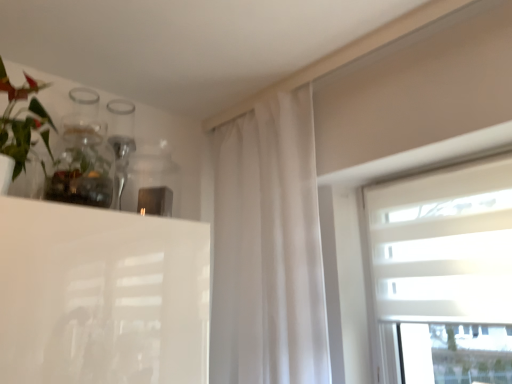
Question: Considering the relative positions of white textured blinds at upper right and clear glass vase at upper left in the image provided, is white textured blinds at upper right to the right of clear glass vase at upper left from the viewer's perspective?

Choices:
 (A) yes
 (B) no

Answer: (A)

Question: From the image's perspective, is white textured blinds at upper right below clear glass vase at upper left?

Choices:
 (A) no
 (B) yes

Answer: (B)

Question: Could clear glass vase at upper left be considered to be inside white textured blinds at upper right?

Choices:
 (A) yes
 (B) no

Answer: (B)

Question: Is white textured blinds at upper right in front of clear glass vase at upper left?

Choices:
 (A) no
 (B) yes

Answer: (A)

Question: Can you confirm if white textured blinds at upper right is positioned to the left of clear glass vase at upper left?

Choices:
 (A) no
 (B) yes

Answer: (A)

Question: Is white textured blinds at upper right positioned beyond the bounds of clear glass vase at upper left?

Choices:
 (A) yes
 (B) no

Answer: (A)

Question: Is clear glass vase at upper left at the left side of white sheer curtain at center?

Choices:
 (A) yes
 (B) no

Answer: (A)

Question: Does clear glass vase at upper left contain white sheer curtain at center?

Choices:
 (A) yes
 (B) no

Answer: (B)

Question: Does clear glass vase at upper left have a lesser height compared to white sheer curtain at center?

Choices:
 (A) yes
 (B) no

Answer: (A)

Question: Are clear glass vase at upper left and white sheer curtain at center far apart?

Choices:
 (A) yes
 (B) no

Answer: (B)

Question: Can you confirm if clear glass vase at upper left is wider than white sheer curtain at center?

Choices:
 (A) no
 (B) yes

Answer: (A)

Question: Is clear glass vase at upper left oriented towards white sheer curtain at center?

Choices:
 (A) yes
 (B) no

Answer: (B)

Question: Considering the relative positions of clear glass vase at upper left and white textured blinds at upper right in the image provided, is clear glass vase at upper left to the right of white textured blinds at upper right from the viewer's perspective?

Choices:
 (A) no
 (B) yes

Answer: (A)